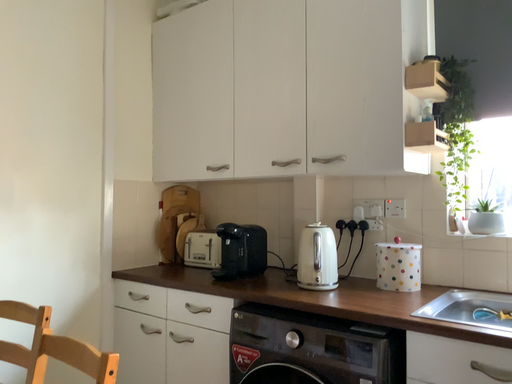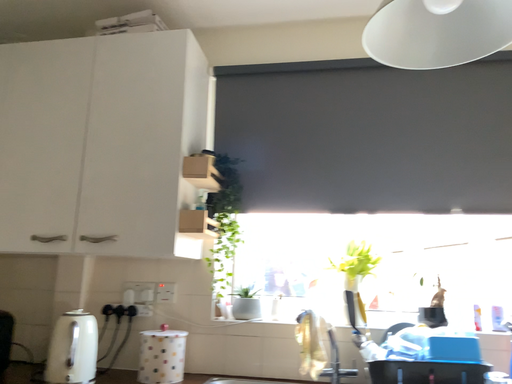
Question: Which way did the camera rotate in the video?

Choices:
 (A) rotated left
 (B) rotated right

Answer: (B)